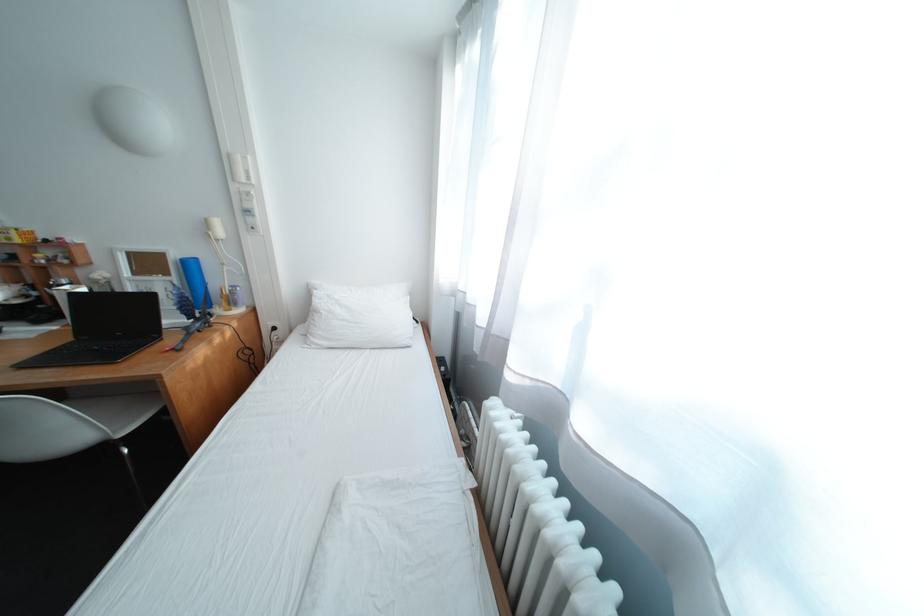
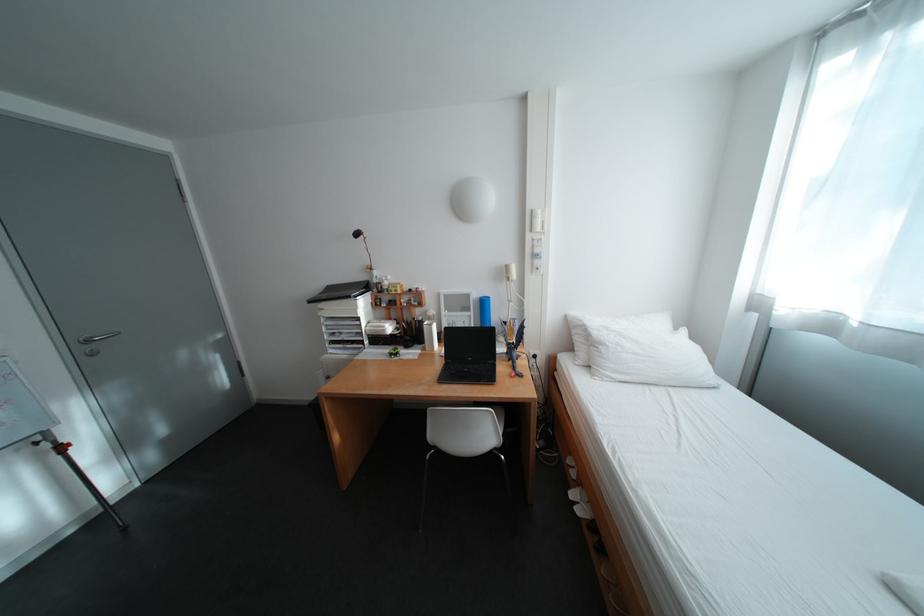
Locate, in the second image, the point that corresponds to (x=130, y=334) in the first image.

(481, 360)